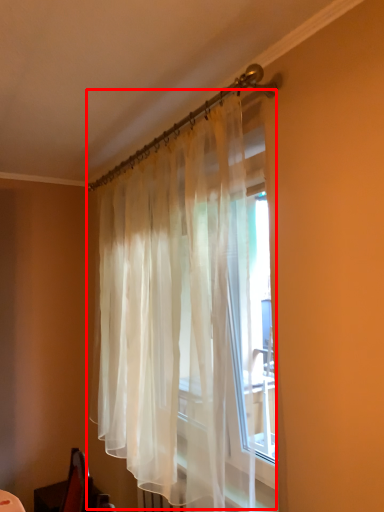
Question: Observing the image, what is the correct spatial positioning of curtain (annotated by the red box) in reference to swivel chair?

Choices:
 (A) right
 (B) left

Answer: (A)